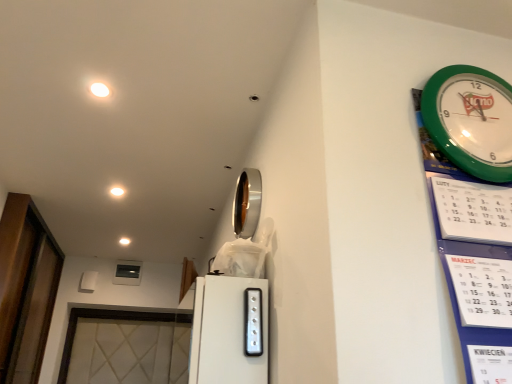
Question: Considering the relative sizes of white glossy light at upper left, which appears as the first light when viewed from the top, and green plastic wall clock at upper right in the image provided, is white glossy light at upper left, which appears as the first light when viewed from the top, bigger than green plastic wall clock at upper right?

Choices:
 (A) no
 (B) yes

Answer: (A)

Question: Considering the relative sizes of white glossy light at upper left, acting as the first light starting from the front, and green plastic wall clock at upper right in the image provided, is white glossy light at upper left, acting as the first light starting from the front, wider than green plastic wall clock at upper right?

Choices:
 (A) no
 (B) yes

Answer: (B)

Question: From a real-world perspective, is white glossy light at upper left, acting as the first light starting from the front, positioned over green plastic wall clock at upper right based on gravity?

Choices:
 (A) yes
 (B) no

Answer: (A)

Question: Is white glossy light at upper left, which is the first light from right to left, at the right side of green plastic wall clock at upper right?

Choices:
 (A) yes
 (B) no

Answer: (B)

Question: From the image's perspective, is white glossy light at upper left, the 3th light in the left-to-right sequence, located beneath green plastic wall clock at upper right?

Choices:
 (A) yes
 (B) no

Answer: (B)

Question: Does white glossy light at upper left, the 3th light in the left-to-right sequence, come in front of green plastic wall clock at upper right?

Choices:
 (A) no
 (B) yes

Answer: (A)

Question: Does silver/metallic mirror at upper center have a greater height compared to green plastic wall clock at upper right?

Choices:
 (A) yes
 (B) no

Answer: (B)

Question: Would you say silver/metallic mirror at upper center is outside green plastic wall clock at upper right?

Choices:
 (A) no
 (B) yes

Answer: (B)

Question: From a real-world perspective, does silver/metallic mirror at upper center sit lower than green plastic wall clock at upper right?

Choices:
 (A) yes
 (B) no

Answer: (B)

Question: From a real-world perspective, is silver/metallic mirror at upper center physically above green plastic wall clock at upper right?

Choices:
 (A) yes
 (B) no

Answer: (A)

Question: Is silver/metallic mirror at upper center at the right side of green plastic wall clock at upper right?

Choices:
 (A) yes
 (B) no

Answer: (B)

Question: Considering the relative positions of silver/metallic mirror at upper center and green plastic wall clock at upper right in the image provided, is silver/metallic mirror at upper center to the left of green plastic wall clock at upper right from the viewer's perspective?

Choices:
 (A) yes
 (B) no

Answer: (A)

Question: Does transparent glass door at left have a lesser height compared to white glossy light at upper left, positioned as the 3th light in back-to-front order?

Choices:
 (A) yes
 (B) no

Answer: (B)